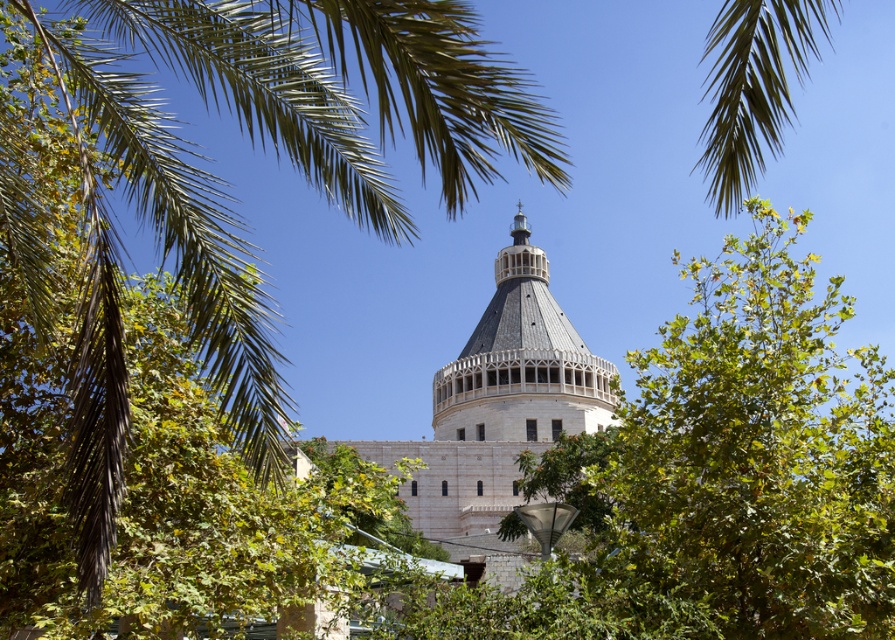
You are standing in front of the large domed structure and notice two points marked in the scene. The first point is at coordinates point (113,413) and the second at point (558,308). Which of these two points is nearer to you?

Point (113,413) is closer to the viewer than point (558,308).

You are a drone operator trying to capture a photo of the dome of the church. You need to avoid the green leafy palm at upper left in your shot. Based on its coordinates, can you determine if the palm is blocking the dome?

The green leafy palm at upper left is located at coordinates point (220, 180), which is in the upper left area of the image. Since the dome is the central feature of the church structure in the image, the palm at upper left may not be directly blocking the dome but could be in the corner of the frame. Adjust the drone position slightly to the right or lower to avoid it while keeping the dome centered.

You are standing in front of the large domed structure and notice a specific point marked in the image. What object is located at the coordinates point [220,180]?

The point [220,180] indicates a green leafy palm at upper left.